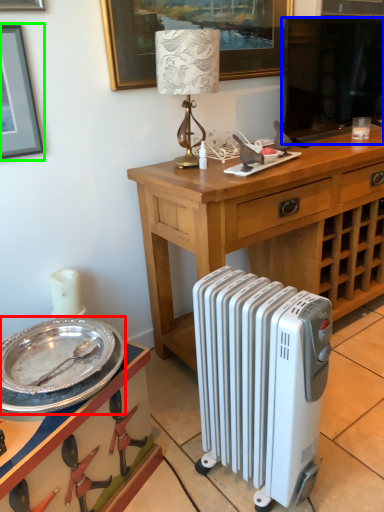
Question: Which is nearer to the plate (highlighted by a red box)? television (highlighted by a blue box) or picture frame (highlighted by a green box).

Choices:
 (A) television
 (B) picture frame

Answer: (B)